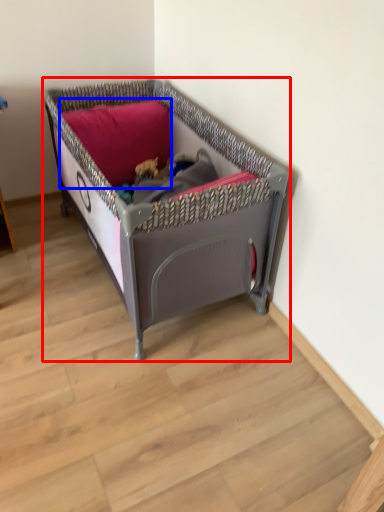
Question: Which object appears farthest to the camera in this image, infant bed (highlighted by a red box) or pillow (highlighted by a blue box)?

Choices:
 (A) infant bed
 (B) pillow

Answer: (B)